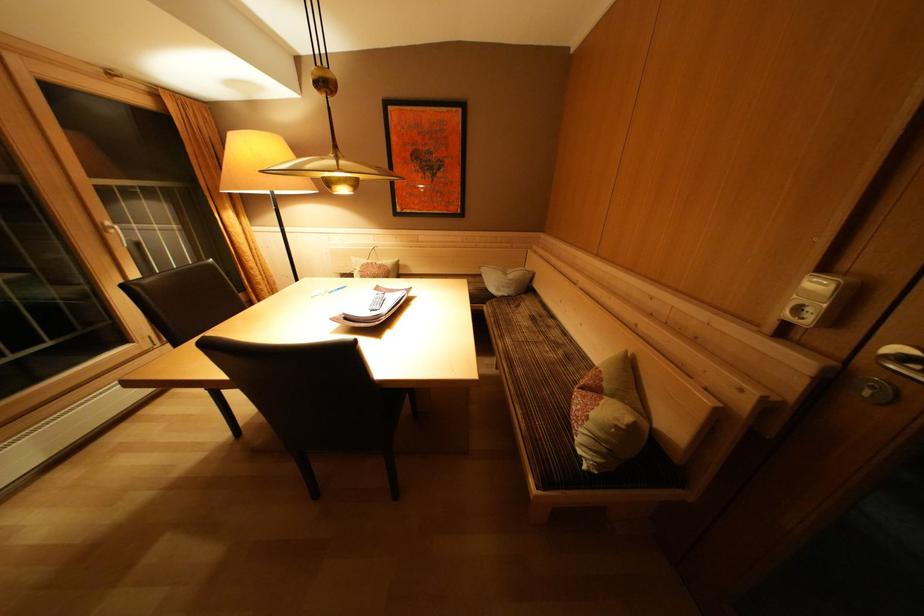
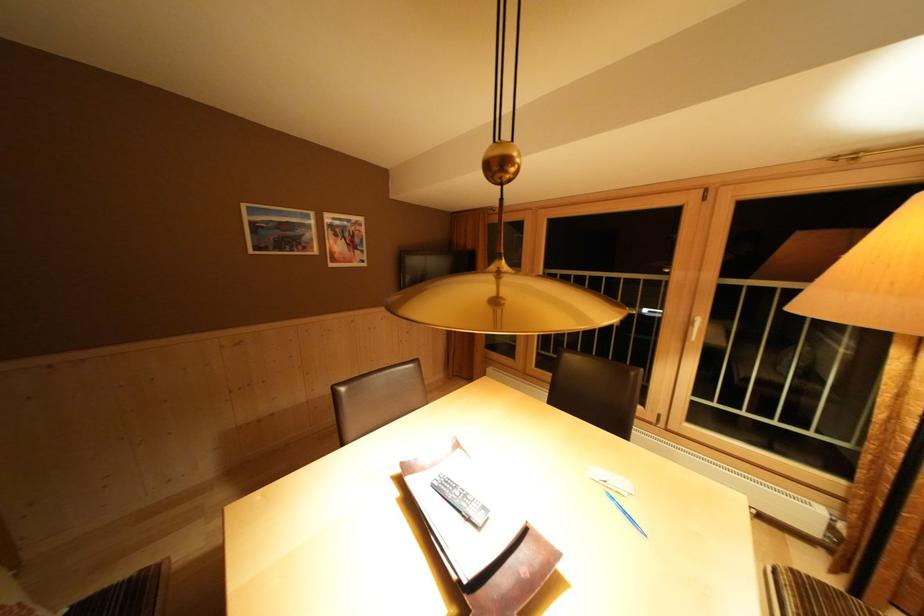
The point at (107, 236) is marked in the first image. Where is the corresponding point in the second image?

(697, 328)